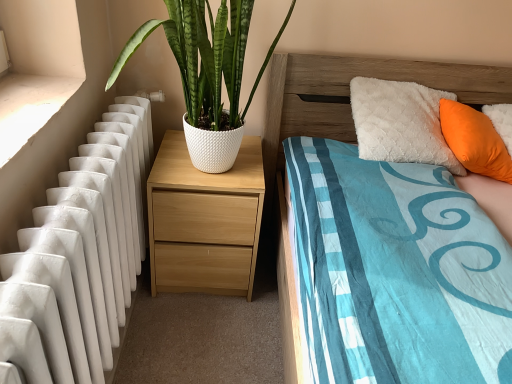
Measure the distance between point (476, 112) and camera.

The depth of point (476, 112) is 5.44 feet.

This screenshot has height=384, width=512. I want to click on wooden headboard at upper right, so tap(349, 94).

In order to face white textured pot at left, should I rotate leftwards or rightwards?

You should look left and rotate roughly 4.646 degrees.

Image resolution: width=512 pixels, height=384 pixels. What are the coordinates of `white smooth concrete at left` in the screenshot? It's located at (29, 107).

Consider the image. Measure the distance from light wood/texture nightstand at center to white textured pot at left.

11.88 inches.

Which is less distant, (243, 177) or (192, 23)?

Point (243, 177) appears to be farther away from the viewer than point (192, 23).

Is light wood/texture nightstand at center wider than white textured pot at left?

No.

Is white textured pot at left at the back of light wood/texture nightstand at center?

No, light wood/texture nightstand at center is not facing away from white textured pot at left.

From the image's perspective, does orange fabric pillow at upper right appear lower than white smooth concrete at left?

Incorrect, from the image's perspective, orange fabric pillow at upper right is higher than white smooth concrete at left.

From a real-world perspective, is orange fabric pillow at upper right on top of white smooth concrete at left?

Incorrect, from a real-world perspective, orange fabric pillow at upper right is lower than white smooth concrete at left.

Is orange fabric pillow at upper right behind white smooth concrete at left?

Yes, orange fabric pillow at upper right is further from the viewer.

Between orange fabric pillow at upper right and white smooth concrete at left, which one has larger width?

Wider between the two is white smooth concrete at left.

From the picture: Which of these two, white smooth concrete at left or light wood/texture nightstand at center, is wider?

With larger width is light wood/texture nightstand at center.

Is white smooth concrete at left directly adjacent to light wood/texture nightstand at center?

white smooth concrete at left and light wood/texture nightstand at center are not in contact.

Is white smooth concrete at left aimed at light wood/texture nightstand at center?

No, white smooth concrete at left does not turn towards light wood/texture nightstand at center.

From the picture: Can you confirm if white smooth concrete at left is positioned to the right of light wood/texture nightstand at center?

In fact, white smooth concrete at left is to the left of light wood/texture nightstand at center.

Is wooden headboard at upper right situated inside white smooth concrete at left or outside?

wooden headboard at upper right is outside white smooth concrete at left.

Is wooden headboard at upper right oriented away from white smooth concrete at left?

That's not correct — wooden headboard at upper right is not looking away from white smooth concrete at left.

From a real-world perspective, relative to white smooth concrete at left, is wooden headboard at upper right vertically above or below?

From a real-world perspective, wooden headboard at upper right is physically below white smooth concrete at left.

In the scene shown: Is wooden headboard at upper right positioned before white smooth concrete at left?

That is False.

From the image's perspective, is wooden headboard at upper right below light wood/texture nightstand at center?

Incorrect, from the image's perspective, wooden headboard at upper right is higher than light wood/texture nightstand at center.

Would you say light wood/texture nightstand at center is part of wooden headboard at upper right's contents?

Actually, light wood/texture nightstand at center is outside wooden headboard at upper right.

Which object is further away from the camera taking this photo, wooden headboard at upper right or light wood/texture nightstand at center?

light wood/texture nightstand at center.

Which object is closer to the camera, wooden headboard at upper right or orange fabric pillow at upper right?

wooden headboard at upper right is more forward.

Is point (332, 117) positioned behind point (493, 178)?

Yes, point (332, 117) is farther from viewer.

From the image's perspective, is wooden headboard at upper right positioned above or below orange fabric pillow at upper right?

wooden headboard at upper right is above orange fabric pillow at upper right.

Based on their sizes in the image, would you say wooden headboard at upper right is bigger or smaller than white textured pot at left?

Clearly, wooden headboard at upper right is smaller in size than white textured pot at left.

Is wooden headboard at upper right positioned with its back to white textured pot at left?

wooden headboard at upper right does not have its back to white textured pot at left.

From the image's perspective, which object appears higher, wooden headboard at upper right or white textured pot at left?

From the image's view, white textured pot at left is above.

Relative to white textured pot at left, is wooden headboard at upper right in front or behind?

wooden headboard at upper right is positioned farther from the viewer than white textured pot at left.

Where is `houseplant lying in front of the light wood/texture nightstand at center`? This screenshot has width=512, height=384. houseplant lying in front of the light wood/texture nightstand at center is located at coordinates (205, 58).

This screenshot has height=384, width=512. In order to click on pillow below the white smooth concrete at left (from a real-world perspective) in this screenshot , I will do `click(475, 141)`.

Looking at the image, which one is located further to orange fabric pillow at upper right, white smooth concrete at left or light wood/texture nightstand at center?

white smooth concrete at left lies further to orange fabric pillow at upper right than the other object.

Estimate the real-world distances between objects in this image. Which object is closer to orange fabric pillow at upper right, white smooth concrete at left or wooden headboard at upper right?

wooden headboard at upper right lies closer to orange fabric pillow at upper right than the other object.

Looking at the image, which one is located closer to white textured pot at left, wooden headboard at upper right or orange fabric pillow at upper right?

Among the two, wooden headboard at upper right is located nearer to white textured pot at left.

Estimate the real-world distances between objects in this image. Which object is closer to white textured pot at left, white smooth concrete at left or wooden headboard at upper right?

Among the two, white smooth concrete at left is located nearer to white textured pot at left.

Based on the photo, which object lies further to the anchor point orange fabric pillow at upper right, white smooth concrete at left or white textured pot at left?

Among the two, white smooth concrete at left is located further to orange fabric pillow at upper right.

Consider the image. Considering their positions, is wooden headboard at upper right positioned closer to white smooth concrete at left than white textured pot at left?

Among the two, white textured pot at left is located nearer to white smooth concrete at left.

Which object lies further to the anchor point light wood/texture nightstand at center, white smooth concrete at left or white textured pot at left?

Among the two, white smooth concrete at left is located further to light wood/texture nightstand at center.

Considering their positions, is white smooth concrete at left positioned further to light wood/texture nightstand at center than wooden headboard at upper right?

Among the two, white smooth concrete at left is located further to light wood/texture nightstand at center.

I want to click on headboard between white textured pot at left and orange fabric pillow at upper right from left to right, so click(349, 94).

Image resolution: width=512 pixels, height=384 pixels. What are the coordinates of `houseplant between white smooth concrete at left and wooden headboard at upper right` in the screenshot? It's located at (205, 58).

The image size is (512, 384). Find the location of `houseplant situated between light wood/texture nightstand at center and wooden headboard at upper right from left to right`. houseplant situated between light wood/texture nightstand at center and wooden headboard at upper right from left to right is located at coordinates (205, 58).

This screenshot has width=512, height=384. I want to click on headboard between white smooth concrete at left and orange fabric pillow at upper right from left to right, so click(349, 94).